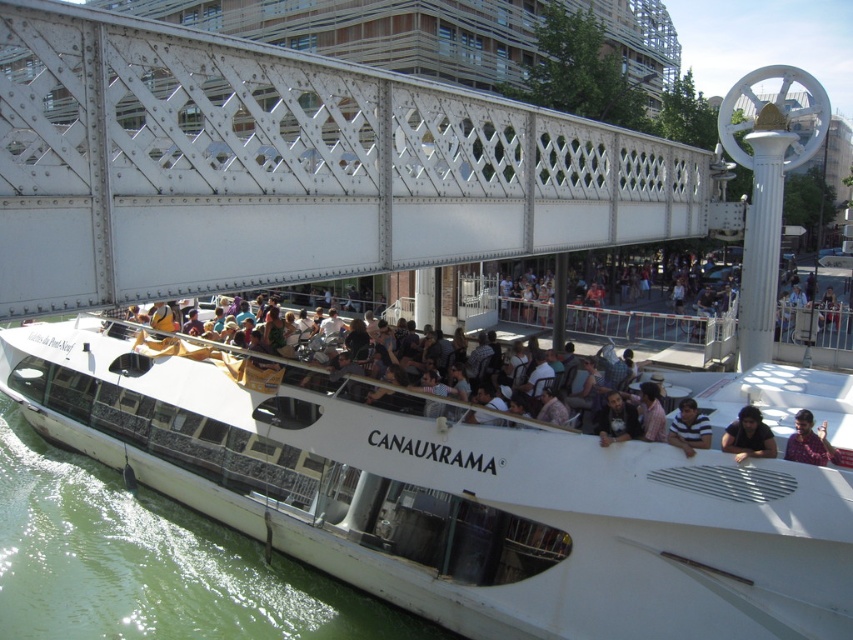
Question: Which object is positioned farthest from the white glossy boat at center?

Choices:
 (A) dark gray fabric at lower right
 (B) dark brown hair at upper right

Answer: (B)

Question: From the image, what is the correct spatial relationship of white glossy boat at center in relation to striped shirt at center?

Choices:
 (A) below
 (B) above

Answer: (A)

Question: Among these points, which one is nearest to the camera?

Choices:
 (A) (479, 544)
 (B) (28, 289)

Answer: (B)

Question: Is white glossy boat at center bigger than dark brown leather jacket at center?

Choices:
 (A) yes
 (B) no

Answer: (A)

Question: Which of these objects is positioned closest to the dark brown leather jacket at center?

Choices:
 (A) white metal bridge at upper center
 (B) white glossy boat at center
 (C) dark brown hair at upper right
 (D) striped shirt at center

Answer: (D)

Question: Observing the image, what is the correct spatial positioning of dark gray fabric at lower right in reference to dark brown leather jacket at center?

Choices:
 (A) below
 (B) above

Answer: (A)